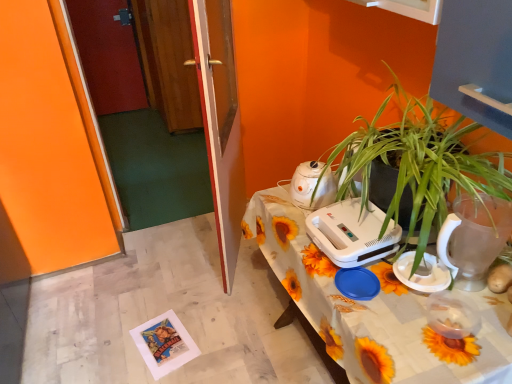
Identify the location of vacant space in front of transparent plastic pitcher at right, marked as the fourth appliance in a back-to-front arrangement. (478, 329).